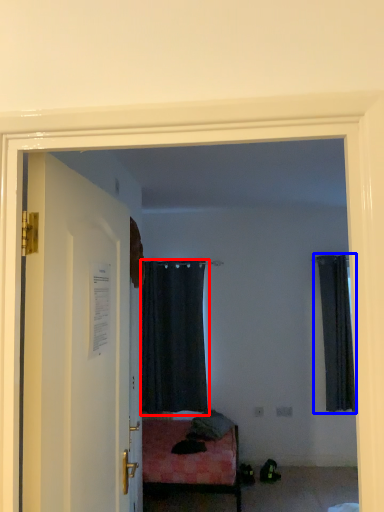
Question: Which of the following is the closest to the observer, curtain (highlighted by a red box) or curtain (highlighted by a blue box)?

Choices:
 (A) curtain
 (B) curtain

Answer: (B)